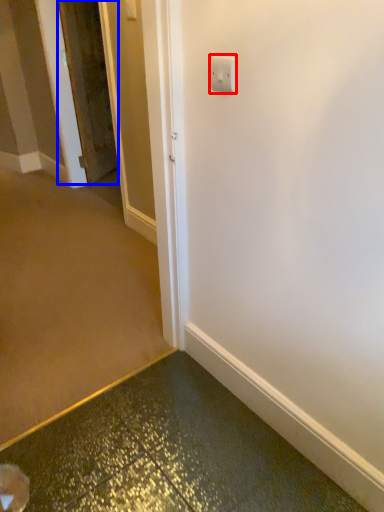
Question: Which of the following is the closest to the observer, light switch (highlighted by a red box) or door (highlighted by a blue box)?

Choices:
 (A) light switch
 (B) door

Answer: (A)